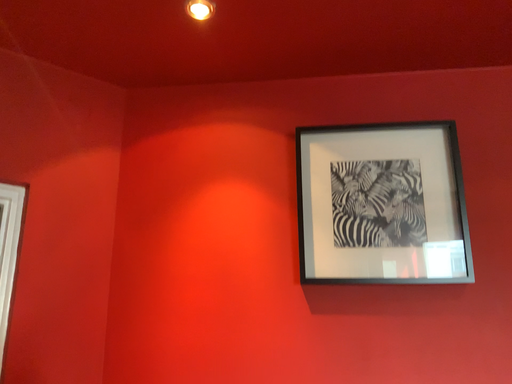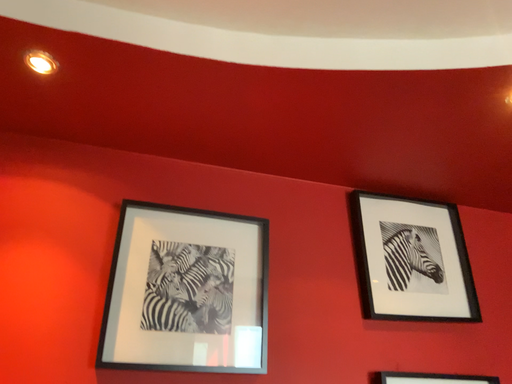
Question: Which way did the camera rotate in the video?

Choices:
 (A) rotated left
 (B) rotated right

Answer: (B)